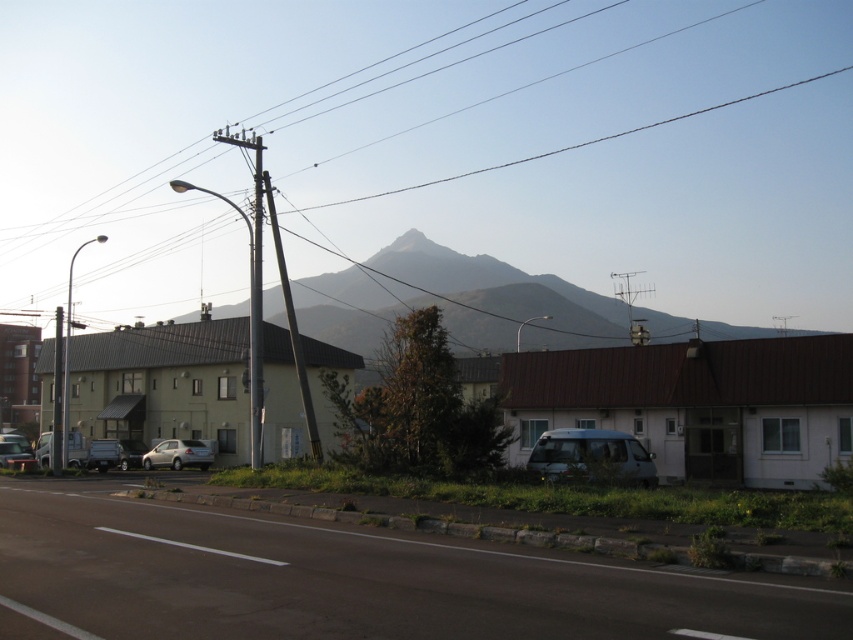
Who is positioned more to the left, smooth gray pole at center or smooth wood telegraph pole at center?

Positioned to the left is smooth gray pole at center.

Is point (254, 330) positioned before point (251, 454)?

Yes, it is.

At what (x,y) coordinates should I click in order to perform the action: click on smooth gray pole at center. Please return your answer as a coordinate pair (x, y). The height and width of the screenshot is (640, 853). Looking at the image, I should click on (253, 292).

This screenshot has height=640, width=853. What do you see at coordinates (254, 312) in the screenshot? I see `smooth wood telegraph pole at center` at bounding box center [254, 312].

Which is behind, point (259, 285) or point (171, 458)?

The point (171, 458) is more distant.

Find the location of `smooth wood telegraph pole at center`. smooth wood telegraph pole at center is located at coordinates (254, 312).

The width and height of the screenshot is (853, 640). Find the location of `smooth wood telegraph pole at center`. smooth wood telegraph pole at center is located at coordinates click(x=254, y=312).

Between point (194, 451) and point (12, 452), which one is positioned behind?

The point (194, 451) is more distant.

Which of these two, satin silver car at lower left or silver metallic car at lower left, stands shorter?

Standing shorter between the two is silver metallic car at lower left.

Is point (149, 467) positioned after point (15, 452)?

Yes, it is.

Find the location of `satin silver car at lower left`. satin silver car at lower left is located at coordinates (178, 454).